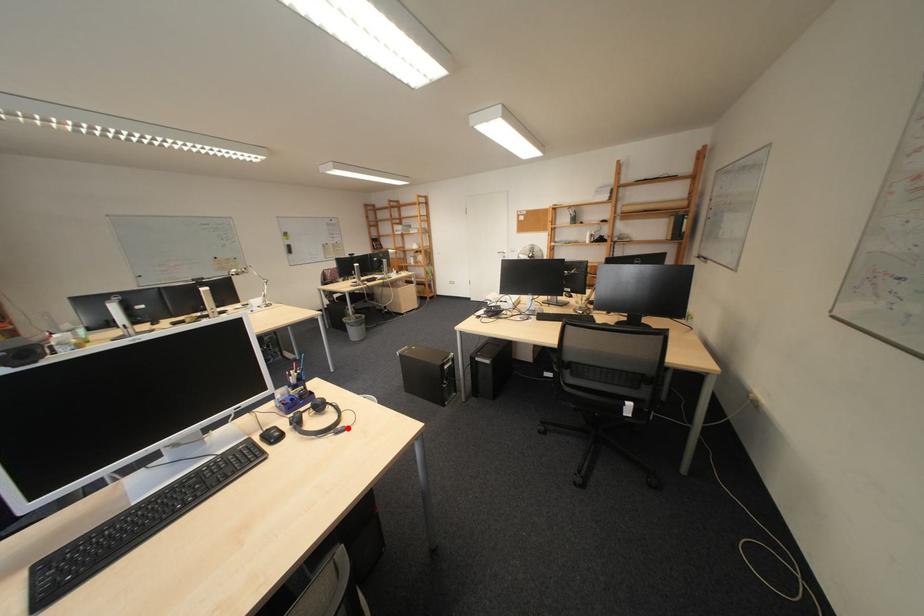
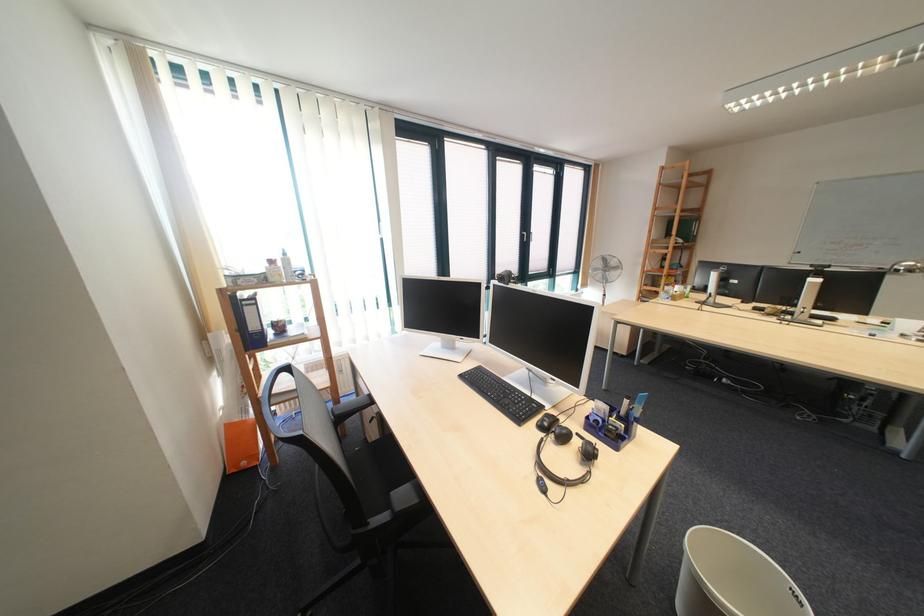
Question: A red point is marked in image1. In image2, is the corresponding 3D point closer to the camera or farther? Reply with the corresponding letter.

Choices:
 (A) The corresponding 3D point is closer.
 (B) The corresponding 3D point is farther.

Answer: (B)